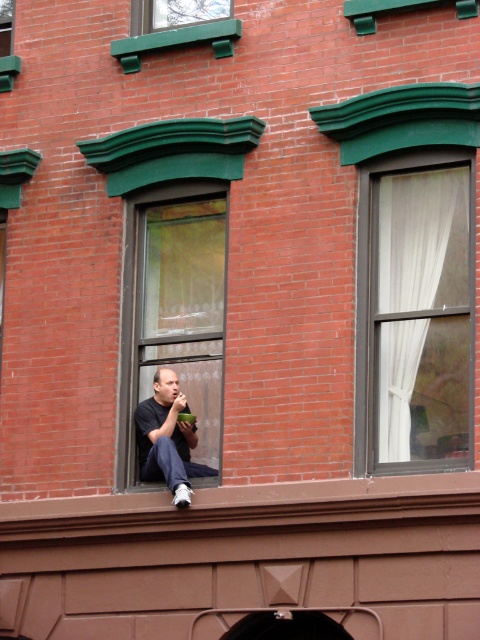
Question: Considering the relative positions of white sheer curtain at upper right and green painted wood window at upper center in the image provided, where is white sheer curtain at upper right located with respect to green painted wood window at upper center?

Choices:
 (A) right
 (B) left

Answer: (A)

Question: Which object appears farthest from the camera in this image?

Choices:
 (A) clear glass window at center
 (B) white sheer curtain at upper right

Answer: (A)

Question: Among these objects, which one is nearest to the camera?

Choices:
 (A) clear glass window at center
 (B) dark blue jeans at center
 (C) green painted wood window at upper center

Answer: (B)

Question: Is clear glass window at center below green painted wood window at upper center?

Choices:
 (A) yes
 (B) no

Answer: (A)

Question: Which of the following is the farthest from the observer?

Choices:
 (A) (204, 420)
 (B) (188, 420)
 (C) (189, 20)

Answer: (C)

Question: Can you confirm if white sheer curtain at upper right is thinner than green painted wood window at upper center?

Choices:
 (A) no
 (B) yes

Answer: (B)